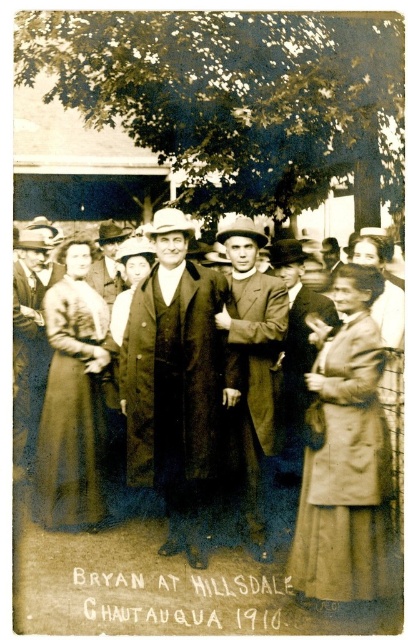
You are a photographer analyzing this historical image. You notice a dark brown wool coat at center. Can you confirm if the point marked at coordinates (175, 381) corresponds to this coat?

Yes, the dark brown wool coat at center is represented by point (175, 381).